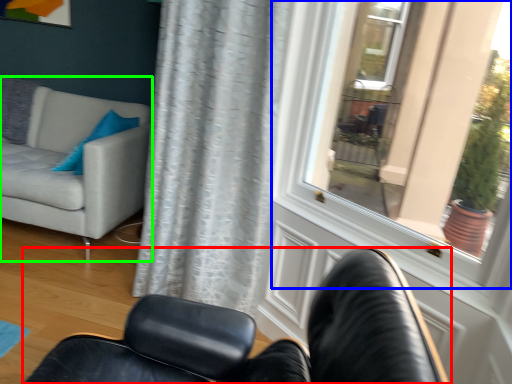
Question: Based on their relative distances, which object is farther from chair (highlighted by a red box)? Choose from window (highlighted by a blue box) and studio couch (highlighted by a green box).

Choices:
 (A) window
 (B) studio couch

Answer: (A)